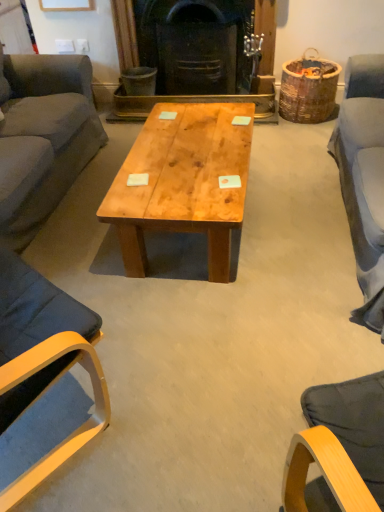
This screenshot has width=384, height=512. What are the coordinates of `empty space that is to the right of natural wood coffee table at center` in the screenshot? It's located at (294, 204).